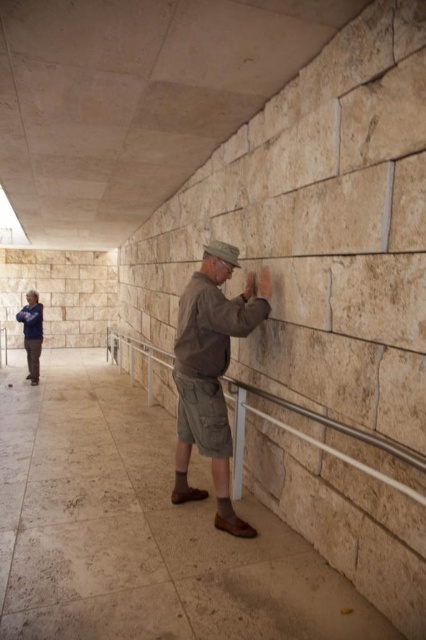
You are a photographer positioned at the entrance of the covered walkway. You want to take a photo of the brown cotton shirt at center. Where should you aim your camera to capture the shirt in the frame?

You should aim your camera at point 0.584 on the horizontal axis and 0.495 on the vertical axis to capture the brown cotton shirt at center.

You are a delivery person who needs to place a package between the brown cotton shirt at center and the blue cotton shirt at lower left. The package is 1.5 feet wide. Is there enough space between them to fit the package?

The distance between the brown cotton shirt at center and the blue cotton shirt at lower left is 19.28 feet, which is significantly wider than the 1.5 feet width of the package. Therefore, there is ample space to place the package between them.